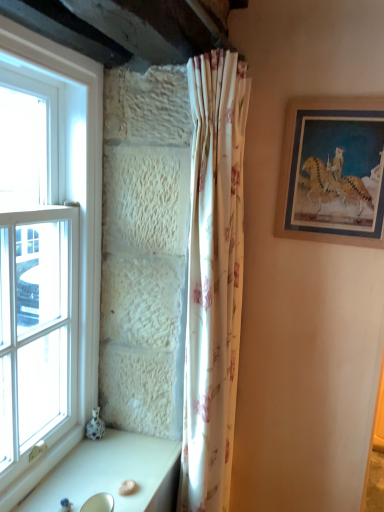
Question: Can we say wooden picture frame at upper right lies outside white glass window at left?

Choices:
 (A) no
 (B) yes

Answer: (B)

Question: Does wooden picture frame at upper right have a larger size compared to white glass window at left?

Choices:
 (A) yes
 (B) no

Answer: (B)

Question: Considering the relative sizes of wooden picture frame at upper right and white glass window at left in the image provided, is wooden picture frame at upper right smaller than white glass window at left?

Choices:
 (A) yes
 (B) no

Answer: (A)

Question: From a real-world perspective, is wooden picture frame at upper right over white glass window at left?

Choices:
 (A) yes
 (B) no

Answer: (A)

Question: Is wooden picture frame at upper right far away from white glass window at left?

Choices:
 (A) yes
 (B) no

Answer: (B)

Question: Is wooden picture frame at upper right touching white glass window at left?

Choices:
 (A) no
 (B) yes

Answer: (A)

Question: Considering the relative sizes of white floral fabric curtain at center and white glossy sink at lower left in the image provided, is white floral fabric curtain at center smaller than white glossy sink at lower left?

Choices:
 (A) no
 (B) yes

Answer: (A)

Question: Does white floral fabric curtain at center have a lesser width compared to white glossy sink at lower left?

Choices:
 (A) yes
 (B) no

Answer: (B)

Question: Considering the relative sizes of white floral fabric curtain at center and white glossy sink at lower left in the image provided, is white floral fabric curtain at center wider than white glossy sink at lower left?

Choices:
 (A) yes
 (B) no

Answer: (A)

Question: Is white floral fabric curtain at center facing towards white glossy sink at lower left?

Choices:
 (A) no
 (B) yes

Answer: (A)

Question: From the image's perspective, does white floral fabric curtain at center appear lower than white glossy sink at lower left?

Choices:
 (A) yes
 (B) no

Answer: (B)

Question: Is white floral fabric curtain at center at the right side of white glossy sink at lower left?

Choices:
 (A) yes
 (B) no

Answer: (A)

Question: Is white glossy table at lower left at the back of white floral fabric curtain at center?

Choices:
 (A) no
 (B) yes

Answer: (A)